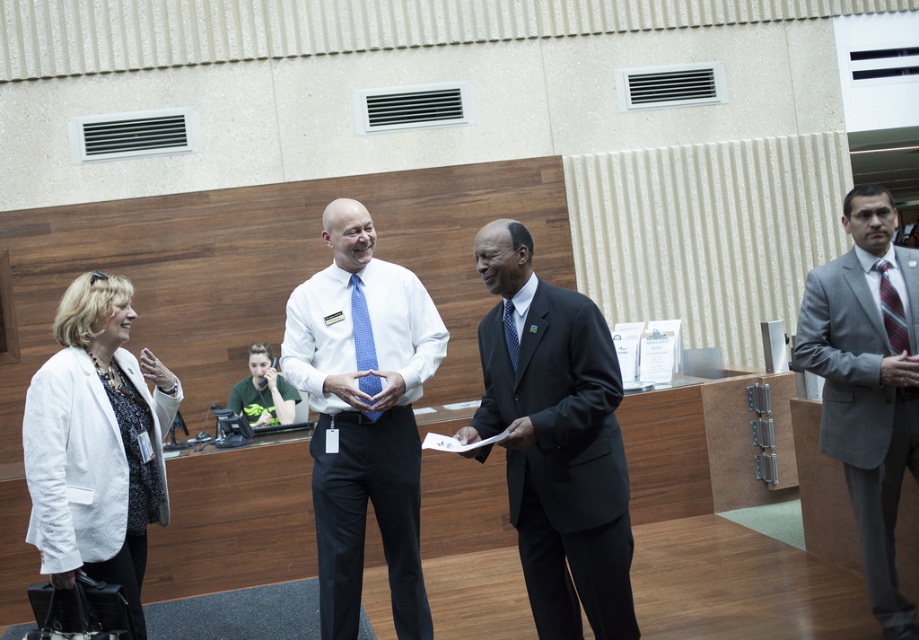
Is matte white shirt at center thinner than white fabric jacket at left?

In fact, matte white shirt at center might be wider than white fabric jacket at left.

Measure the distance between matte white shirt at center and camera.

They are 4.04 meters apart.

Locate an element on the screen. matte white shirt at center is located at coordinates (362, 416).

Based on the photo, is gray suit at right above blue textured tie at center?

No.

Is gray suit at right taller than blue textured tie at center?

Indeed, gray suit at right has a greater height compared to blue textured tie at center.

Where is `gray suit at right`? gray suit at right is located at coordinates (868, 381).

At what (x,y) coordinates should I click in order to perform the action: click on gray suit at right. Please return your answer as a coordinate pair (x, y). This screenshot has height=640, width=919. Looking at the image, I should click on (868, 381).

Is point (882, 627) more distant than point (512, 348)?

Yes.

Who is more distant from viewer, (821, 353) or (512, 368)?

Point (821, 353)

Where is `gray suit at right`? The height and width of the screenshot is (640, 919). gray suit at right is located at coordinates (868, 381).